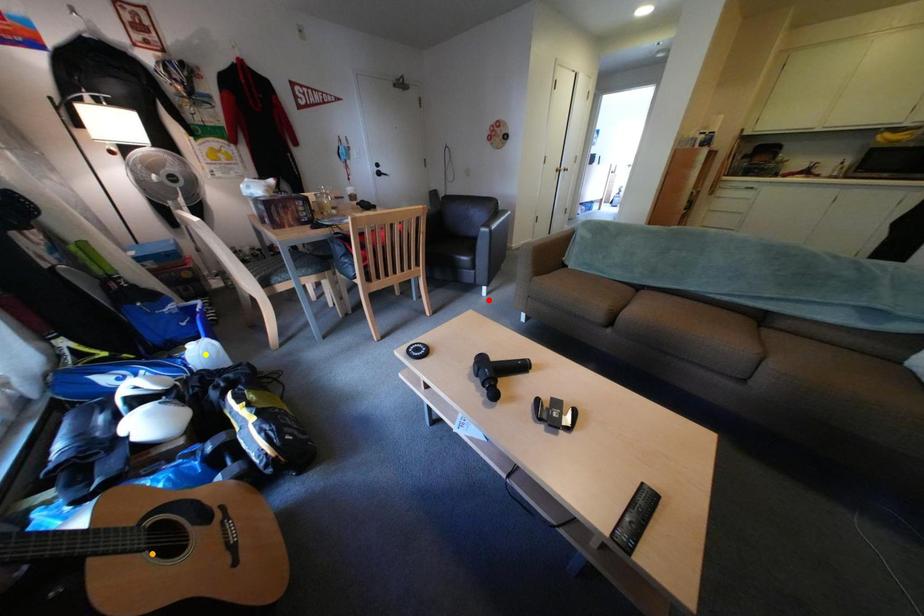
Order these from nearest to farthest:
A) red point
B) orange point
C) yellow point

orange point → yellow point → red point